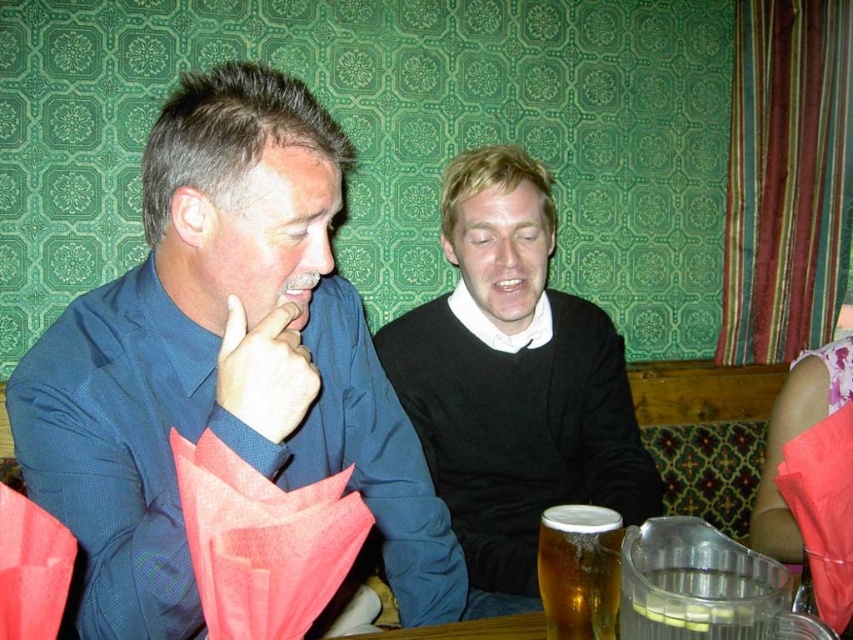
Which is behind, point (258, 429) or point (567, 625)?

The point (567, 625) is behind.

Measure the distance from matte blue shirt at left to golden amber liquid at lower center.

matte blue shirt at left is 12.37 inches from golden amber liquid at lower center.

Who is more forward, (292, 396) or (593, 522)?

Point (292, 396) is more forward.

Identify the location of matte blue shirt at left. Image resolution: width=853 pixels, height=640 pixels. (265, 371).

This screenshot has height=640, width=853. What do you see at coordinates (223, 364) in the screenshot? I see `blue textured shirt at left` at bounding box center [223, 364].

Can you confirm if blue textured shirt at left is positioned to the right of matte blue shirt at left?

No, blue textured shirt at left is not to the right of matte blue shirt at left.

Locate an element on the screen. The width and height of the screenshot is (853, 640). blue textured shirt at left is located at coordinates (223, 364).

Where is `blue textured shirt at left`? blue textured shirt at left is located at coordinates (223, 364).

Does blue textured shirt at left have a greater height compared to black matte sweater at center?

No.

Is the position of blue textured shirt at left less distant than that of black matte sweater at center?

Yes, it is.

Which is behind, point (149, 492) or point (526, 420)?

The point (526, 420) is more distant.

Locate an element on the screen. The width and height of the screenshot is (853, 640). blue textured shirt at left is located at coordinates [x=223, y=364].